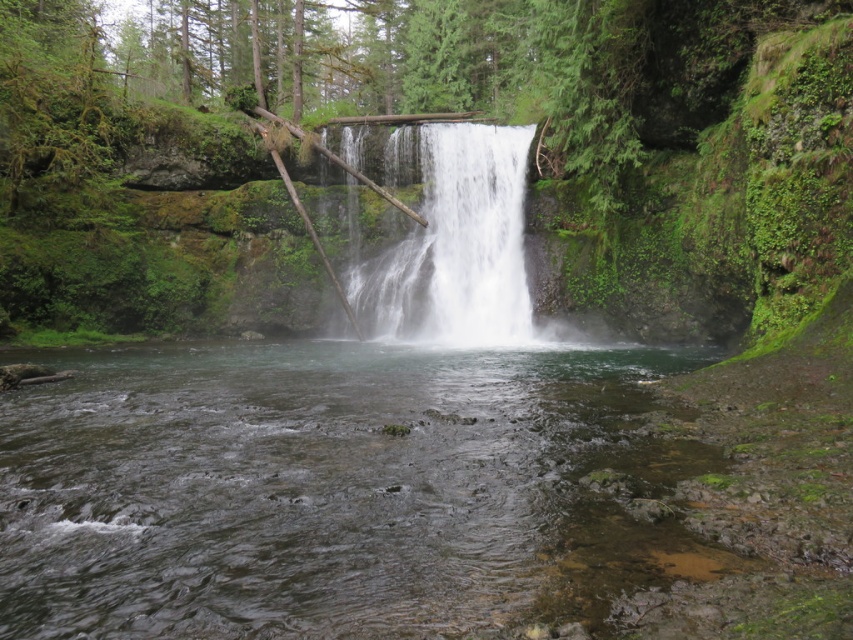
Who is positioned more to the right, clear water at center or white frothy water at center?

white frothy water at center is more to the right.

Is clear water at center closer to the viewer compared to white frothy water at center?

Yes, it is.

Who is more distant from viewer, (590, 547) or (476, 211)?

Point (476, 211)

The height and width of the screenshot is (640, 853). In order to click on clear water at center in this screenshot , I will do `click(318, 488)`.